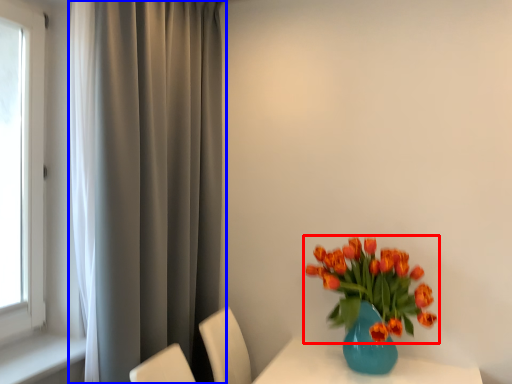
Question: Which object appears closest to the camera in this image, flower (highlighted by a red box) or curtain (highlighted by a blue box)?

Choices:
 (A) flower
 (B) curtain

Answer: (B)